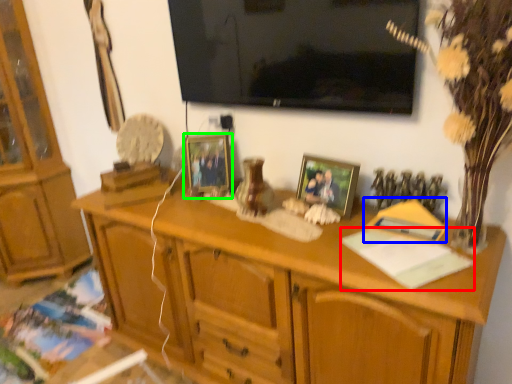
Question: Estimate the real-world distances between objects in this image. Which object is farther from book (highlighted by a red box), book (highlighted by a blue box) or picture frame (highlighted by a green box)?

Choices:
 (A) book
 (B) picture frame

Answer: (B)